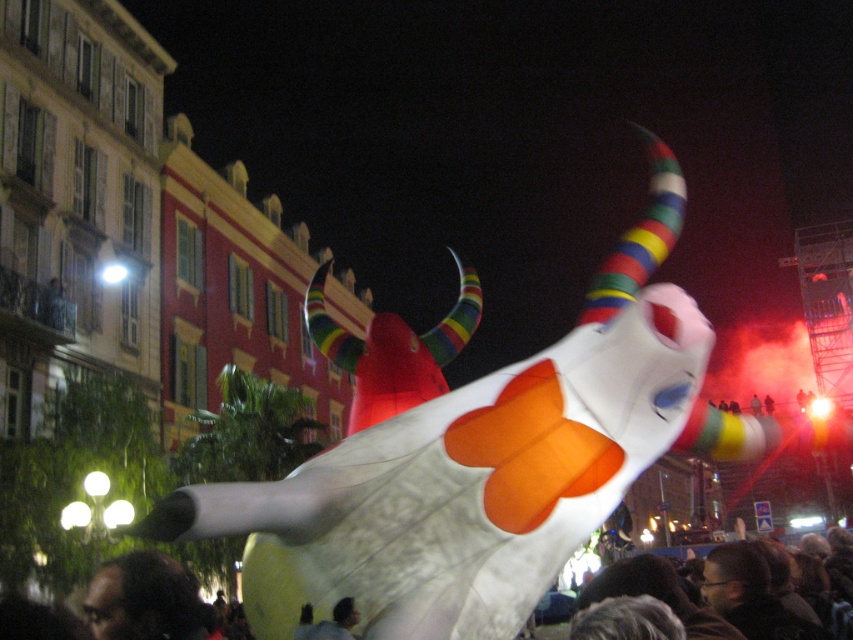
Does white fabric bull at center appear over dark hair at lower left?

Correct, white fabric bull at center is located above dark hair at lower left.

Is white fabric bull at center below dark hair at lower left?

No, white fabric bull at center is not below dark hair at lower left.

Is point (693, 394) positioned behind point (167, 568)?

That is False.

Image resolution: width=853 pixels, height=640 pixels. Identify the location of white fabric bull at center. (471, 465).